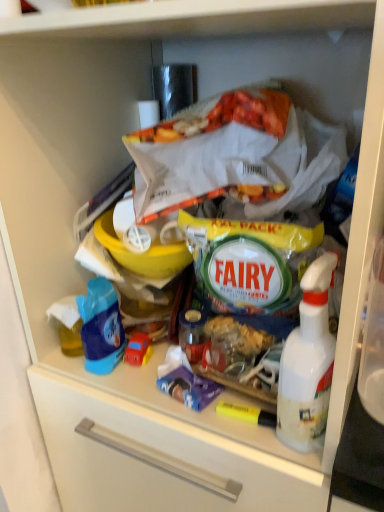
Question: Is white plastic spray bottle at right taller or shorter than rubber car at center?

Choices:
 (A) tall
 (B) short

Answer: (A)

Question: Is white plastic spray bottle at right in front of or behind rubber car at center in the image?

Choices:
 (A) front
 (B) behind

Answer: (A)

Question: Considering the real-world distances, which object is farthest from the rubber car at center?

Choices:
 (A) blue plastic toy car at left
 (B) white plastic spray bottle at right

Answer: (B)

Question: Estimate the real-world distances between objects in this image. Which object is farther from the rubber car at center?

Choices:
 (A) blue plastic toy car at left
 (B) white plastic spray bottle at right

Answer: (B)